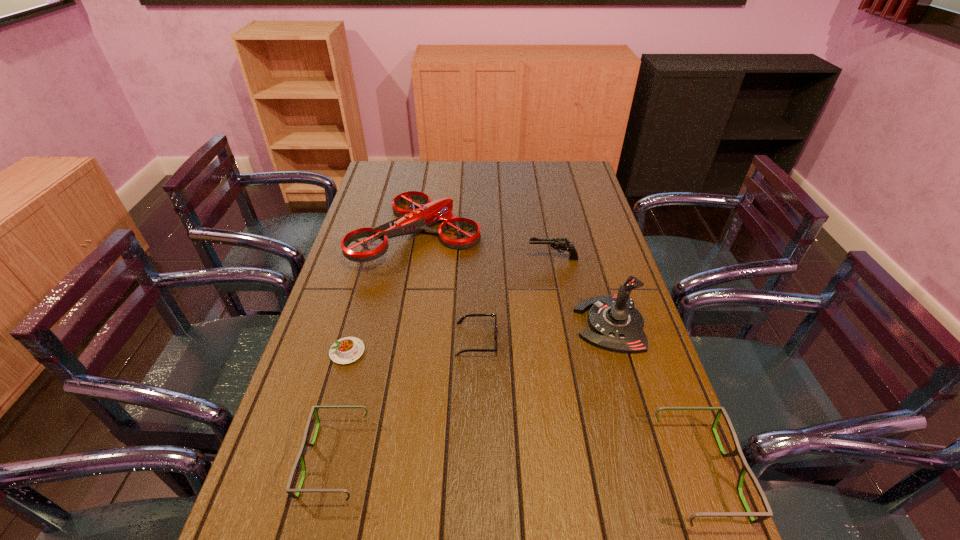
Image resolution: width=960 pixels, height=540 pixels. What are the coordinates of `the third shortest object` in the screenshot? It's located at (300, 456).

Image resolution: width=960 pixels, height=540 pixels. Find the location of `the shorter spectacles`. the shorter spectacles is located at coordinates (300, 456).

Find the location of a particular element. Image resolution: width=960 pixels, height=540 pixels. the right spectacles is located at coordinates (763, 516).

Locate an element on the screen. This screenshot has height=540, width=960. drone is located at coordinates (412, 221).

This screenshot has width=960, height=540. What are the coordinates of `the sixth tallest object` in the screenshot? It's located at (469, 315).

Where is `gun`? The height and width of the screenshot is (540, 960). gun is located at coordinates (560, 244).

Identify the location of the tallest object. (616, 325).

Identify the location of pudding. The height and width of the screenshot is (540, 960). (348, 349).

Image resolution: width=960 pixels, height=540 pixels. Find the location of `free space located 0.300m on the back of the drone`. free space located 0.300m on the back of the drone is located at coordinates (430, 163).

I want to click on vacant area located 0.270m on the front-facing side of the sixth tallest object, so click(x=596, y=339).